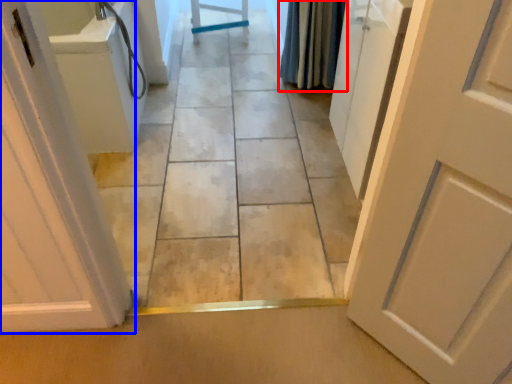
Question: Which point is further to the camera, shower curtain (highlighted by a red box) or door (highlighted by a blue box)?

Choices:
 (A) shower curtain
 (B) door

Answer: (A)